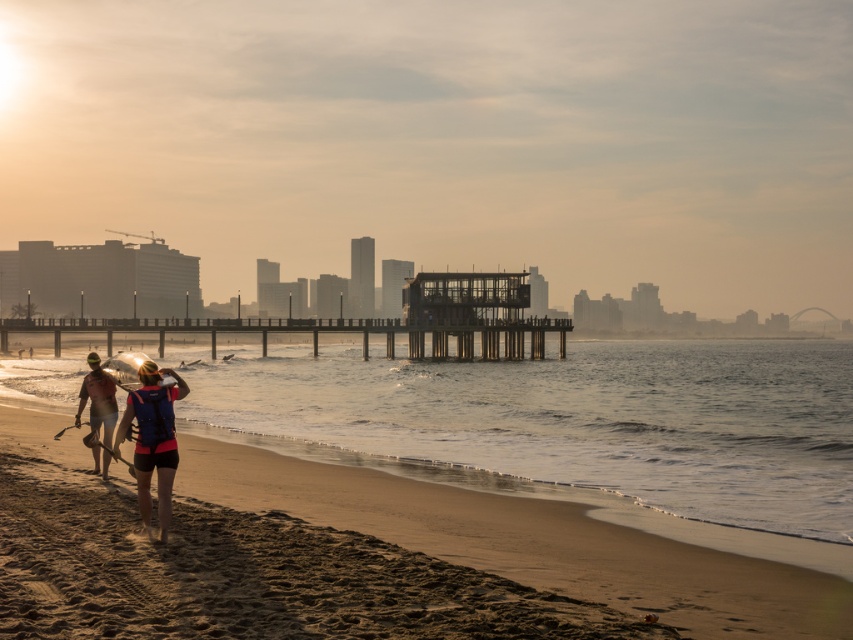
Is point (354, 408) positioned in front of point (802, 618)?

No, (354, 408) is behind (802, 618).

Which is more to the left, clear water at beach left or sandy beach at lower left?

sandy beach at lower left

Where is `clear water at beach left`? The width and height of the screenshot is (853, 640). clear water at beach left is located at coordinates pyautogui.click(x=572, y=420).

Image resolution: width=853 pixels, height=640 pixels. In order to click on clear water at beach left in this screenshot , I will do `click(572, 420)`.

Between point (404, 324) and point (85, 390), which one is positioned behind?

The point (404, 324) is behind.

Identify the location of wooden pier at center. This screenshot has width=853, height=640. (375, 320).

Can you confirm if wooden pier at center is positioned above blue life vest at center?

Yes, wooden pier at center is above blue life vest at center.

Between wooden pier at center and blue life vest at center, which one has more height?

With more height is wooden pier at center.

Is point (529, 323) closer to viewer compared to point (163, 481)?

No, (529, 323) is further to viewer.

The height and width of the screenshot is (640, 853). Identify the location of wooden pier at center. (375, 320).